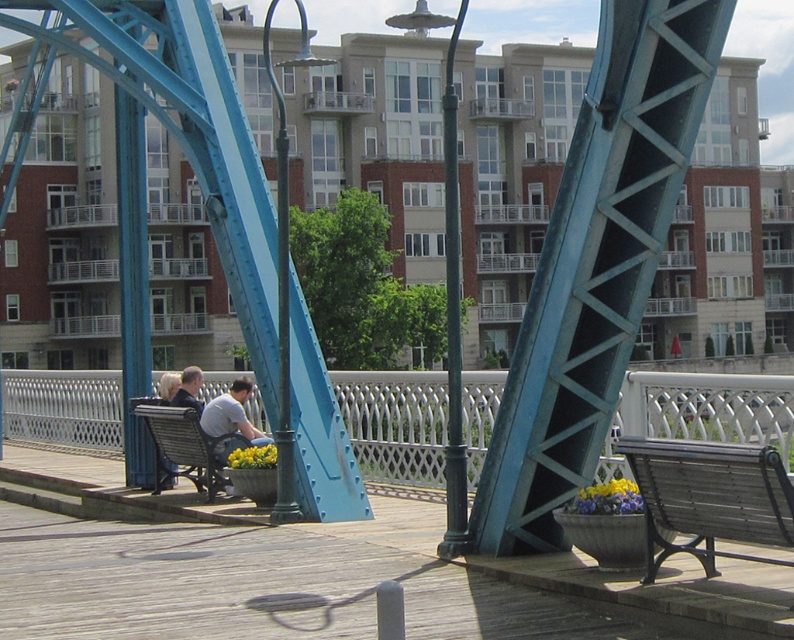
Question: Does white metal fence at lower center have a greater width compared to green metallic pole at center?

Choices:
 (A) no
 (B) yes

Answer: (B)

Question: Which point appears closest to the camera in this image?

Choices:
 (A) (706, 508)
 (B) (334, 388)
 (C) (230, 422)
 (D) (272, 513)

Answer: (A)

Question: Does white metal fence at lower center have a smaller size compared to green metallic pole at center?

Choices:
 (A) yes
 (B) no

Answer: (A)

Question: Is white metal fence at lower center to the right of wooden bench at center from the viewer's perspective?

Choices:
 (A) yes
 (B) no

Answer: (A)

Question: Which of the following is the farthest from the observer?

Choices:
 (A) green metal lamp post at center
 (B) wooden bench at right
 (C) white metal fence at lower center

Answer: (A)

Question: Considering the real-world distances, which object is farthest from the wooden bench at right?

Choices:
 (A) white metal fence at lower center
 (B) green metallic pole at center
 (C) green metal lamp post at center

Answer: (C)